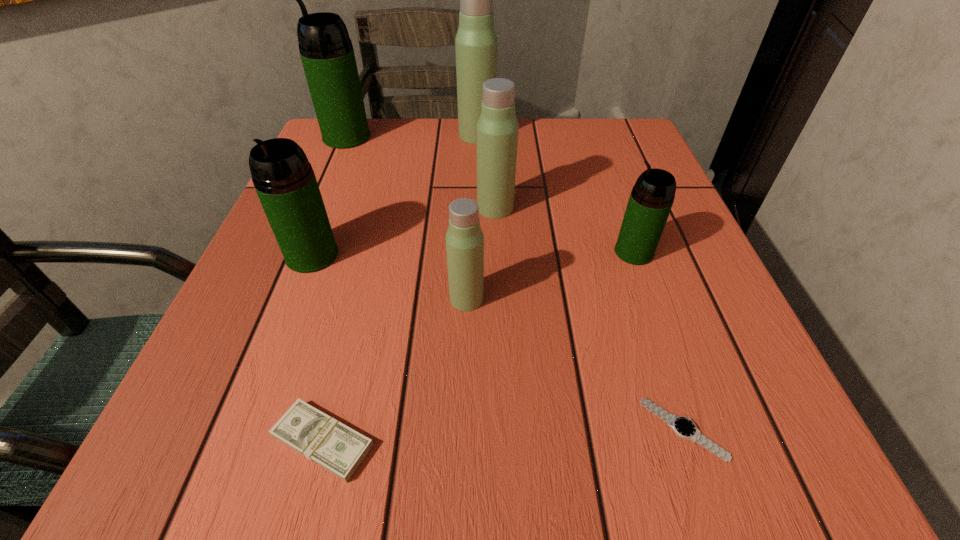
At what (x,y) coordinates should I click in order to perform the action: click on the farthest green thermos bottle. Please return your answer as a coordinate pair (x, y). Looking at the image, I should click on (327, 54).

The width and height of the screenshot is (960, 540). In order to click on the farthest light thermos bottle in this screenshot , I will do `click(476, 43)`.

The width and height of the screenshot is (960, 540). I want to click on the second biggest green thermos bottle, so click(x=284, y=180).

Identify the location of the third farthest object. The height and width of the screenshot is (540, 960). (497, 128).

This screenshot has height=540, width=960. I want to click on the second farthest light thermos bottle, so click(497, 128).

The image size is (960, 540). What are the coordinates of `the smallest green thermos bottle` in the screenshot? It's located at (651, 199).

The height and width of the screenshot is (540, 960). In order to click on the rightmost thermos bottle in this screenshot , I will do `click(651, 199)`.

Where is `the third nearest object`? the third nearest object is located at coordinates (464, 239).

Locate an element on the screen. The image size is (960, 540). the nearest thermos bottle is located at coordinates pos(464,239).

Find the location of a particular element. The image size is (960, 540). the seventh tallest object is located at coordinates (337, 448).